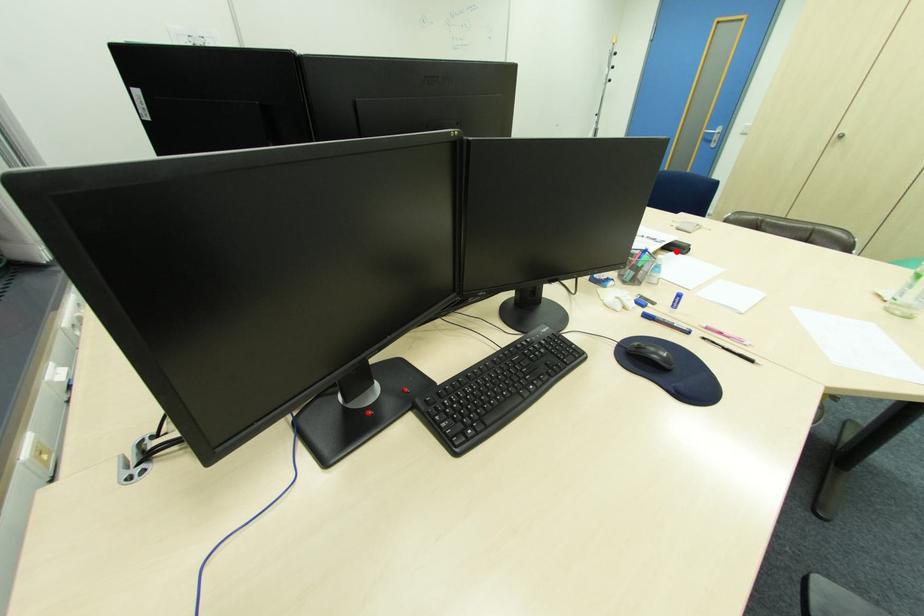
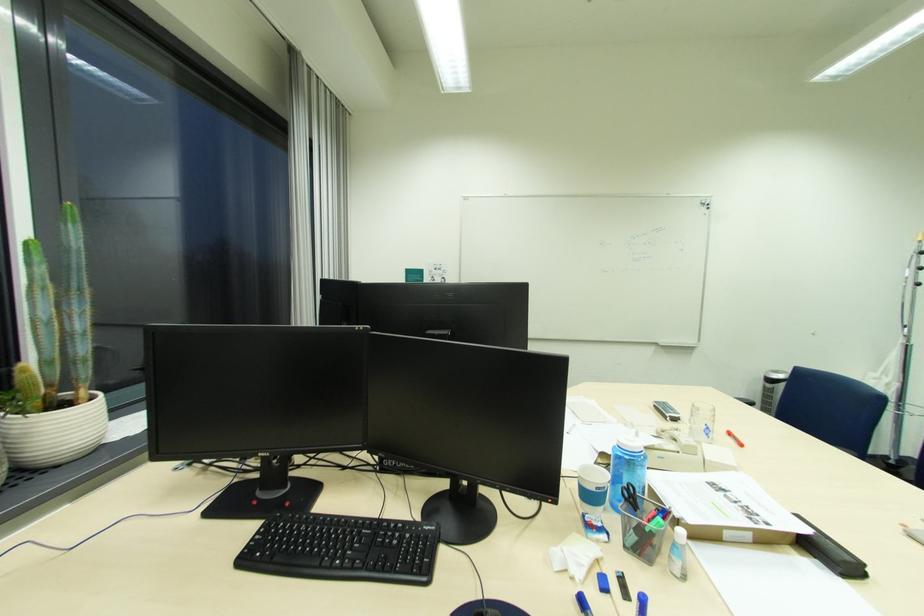
Question: I am providing you with two images of the same scene from different viewpoints. In image1, a red point is highlighted. Considering the same 3D point in image2, which of the following is correct?

Choices:
 (A) It is closer
 (B) It is farther

Answer: (A)